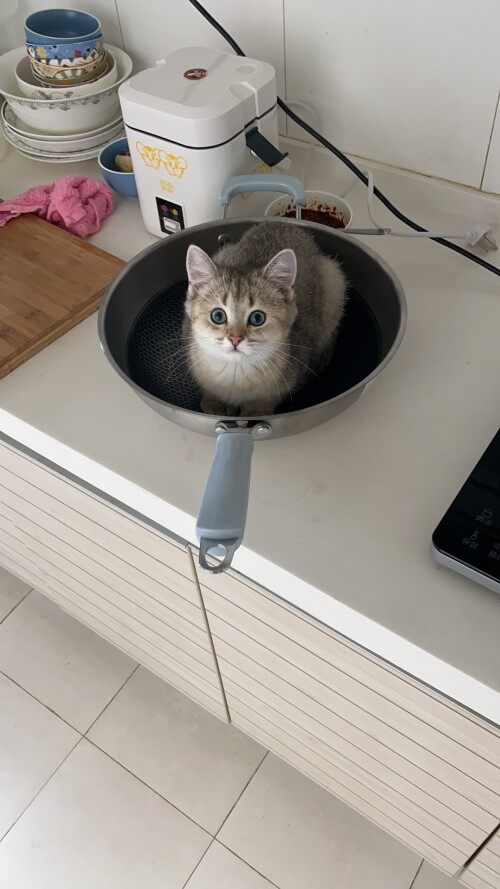
Locate an element on the screen. countertop is located at coordinates (325, 514), (93, 427), (430, 363).